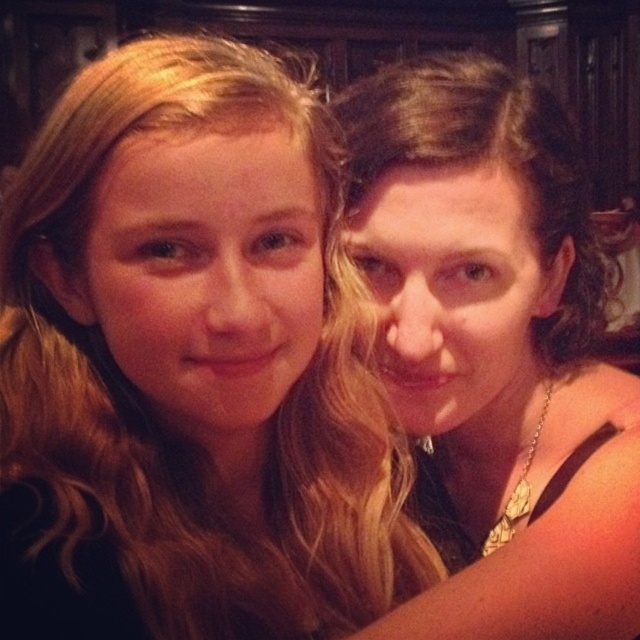
You are a photographer trying to adjust the lighting to highlight both the blonde hair at center and the matte gold necklace at upper right. Since the lighting is currently soft and warm, which object might require more focused light to be properly seen?

The matte gold necklace at upper right requires more focused light because it is thicker than the blonde hair at center, making it harder to capture its details in soft lighting.

You are a photographer adjusting the lighting for a portrait. You notice the blonde hair at center and the matte gold necklace at upper right in the frame. Which object should you adjust the lighting to highlight first if you want to ensure both are well lit, considering their positions?

The blonde hair at center should be adjusted first because it is positioned below the matte gold necklace at upper right, so adjusting the lower area first ensures proper lighting for both without overexposing the upper regions.